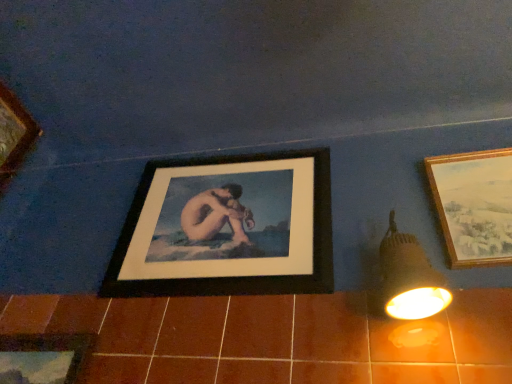
Question: Considering the positions of matte black light fixture at right and black matte picture frame at center, marked as the second picture frame in a right-to-left arrangement, in the image, is matte black light fixture at right bigger or smaller than black matte picture frame at center, marked as the second picture frame in a right-to-left arrangement,?

Choices:
 (A) big
 (B) small

Answer: (B)

Question: Do you think matte black light fixture at right is within black matte picture frame at center, marked as the second picture frame in a right-to-left arrangement, or outside of it?

Choices:
 (A) outside
 (B) inside

Answer: (A)

Question: Estimate the real-world distances between objects in this image. Which object is farther from the black matte picture frame at center, marked as the second picture frame in a right-to-left arrangement?

Choices:
 (A) wooden framed landscape painting at right, placed as the 1th picture frame when sorted from right to left
 (B) wooden picture frame at lower left, which is the 1th picture frame in left-to-right order
 (C) matte black light fixture at right
 (D) brown ceramic tile at lower center

Answer: (A)

Question: Which is nearer to the brown ceramic tile at lower center?

Choices:
 (A) wooden framed landscape painting at right, placed as the 1th picture frame when sorted from right to left
 (B) wooden picture frame at lower left, which is the 1th picture frame in left-to-right order
 (C) matte black light fixture at right
 (D) black matte picture frame at center, marked as the second picture frame in a right-to-left arrangement

Answer: (C)